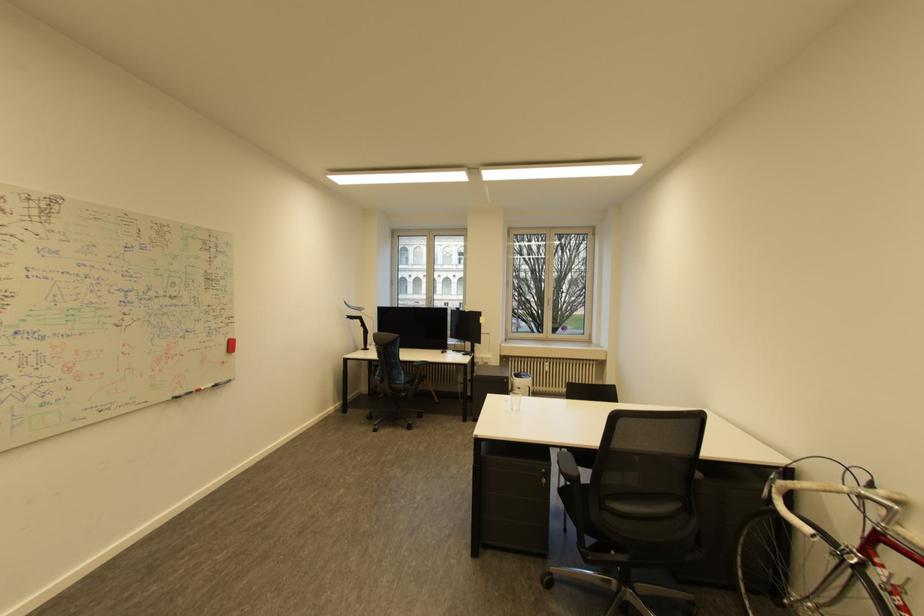
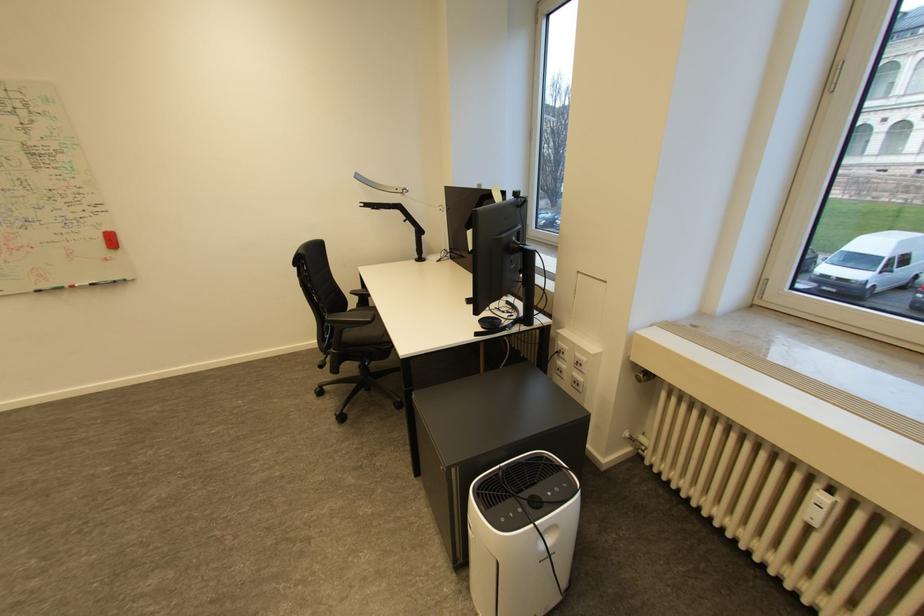
Find the pixel in the second image that matches (x=234, y=342) in the first image.

(108, 235)